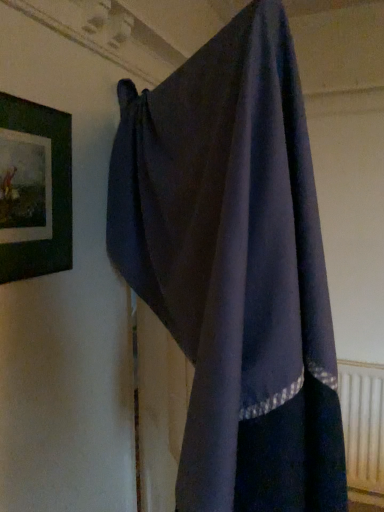
I want to click on dark blue fabric at center, so click(235, 267).

What do you see at coordinates (235, 267) in the screenshot?
I see `dark blue fabric at center` at bounding box center [235, 267].

This screenshot has height=512, width=384. I want to click on dark blue fabric at center, so click(x=235, y=267).